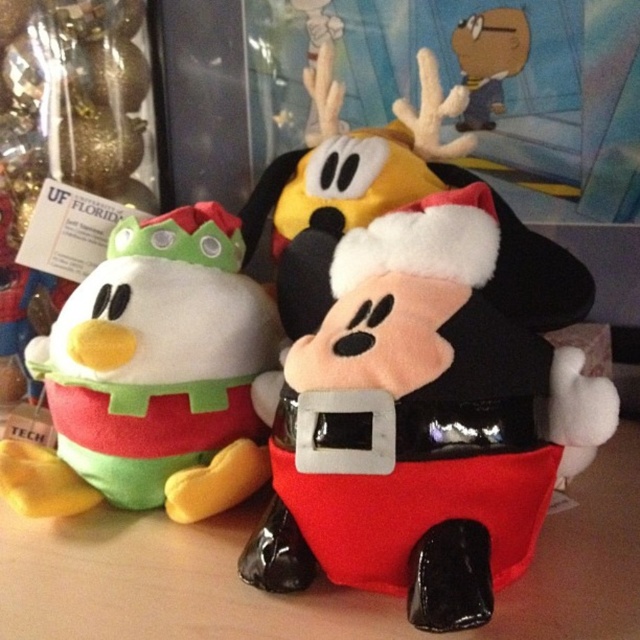
You are a toy organizer trying to place a new plush toy that is 18 inches wide onto the wooden surface. The velvet santa mickey at center and the smooth brown hat at upper center are already there. Can the new toy fit between them without overlapping?

The velvet santa mickey at center is 20.89 inches away from the smooth brown hat at upper center. Since the new toy is 18 inches wide, there is enough space between them to place it without overlapping.

You are standing at the position of the camera and want to pick up the plush toy located at point (362, 364). If your hand can reach up to 25 inches, will you be able to reach it?

The point (362, 364) is 27.40 inches away from the camera. Since your hand can only reach up to 25 inches, you will not be able to reach it.

You are standing in front of the wooden surface with the three festive plush toys. There are two points marked on the surface. The first point is at coordinates point [452,488] and the second point is at point [148,352]. If you want to place a small gift exactly halfway between these two points, where would it be located?

The halfway point between point [452,488] and point [148,352] would be at coordinates point 0.657, 0.471.